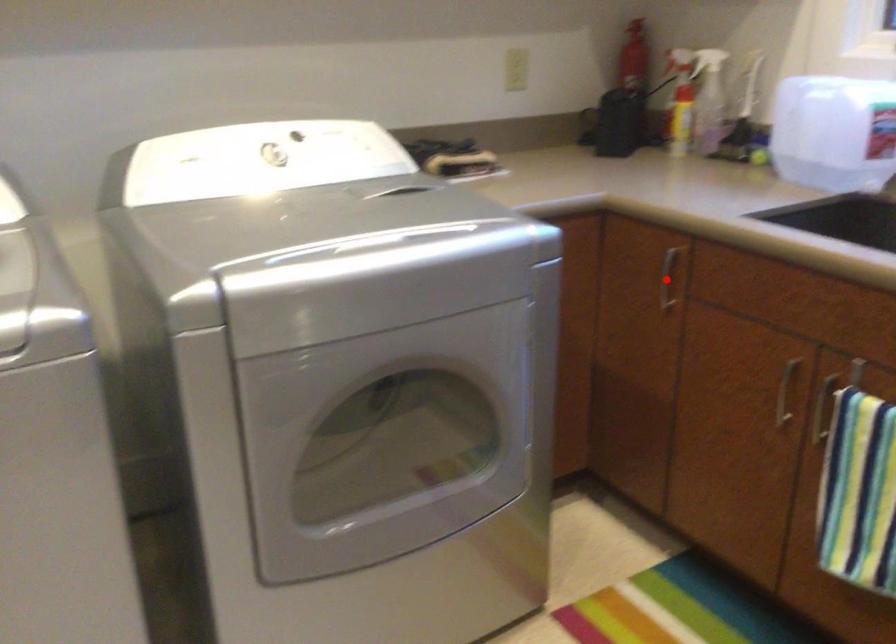
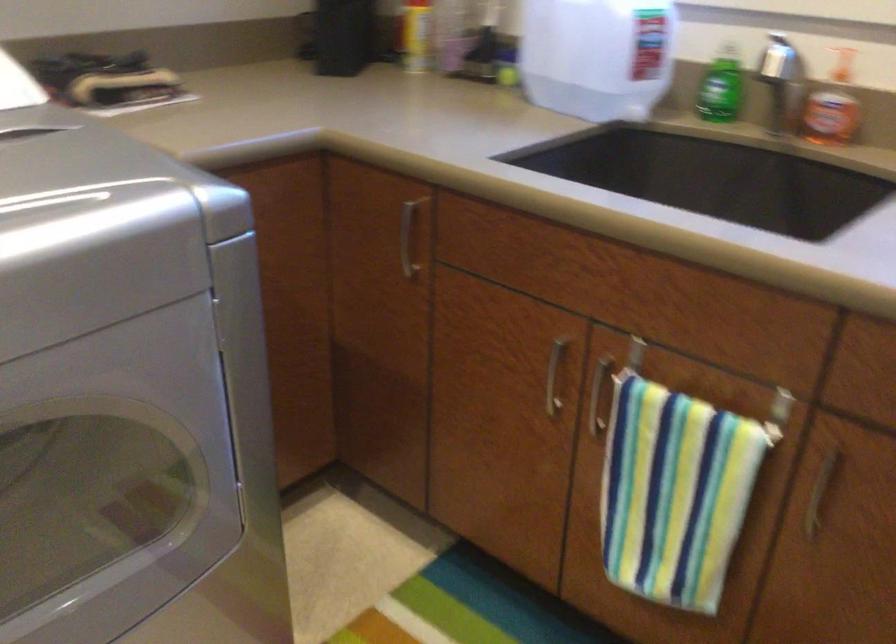
Question: I am providing you with two images of the same scene from different viewpoints. Image1 has a red point marked. In image2, the corresponding 3D location appears at what relative position? Reply with the corresponding letter.

Choices:
 (A) Closer
 (B) Farther

Answer: (A)